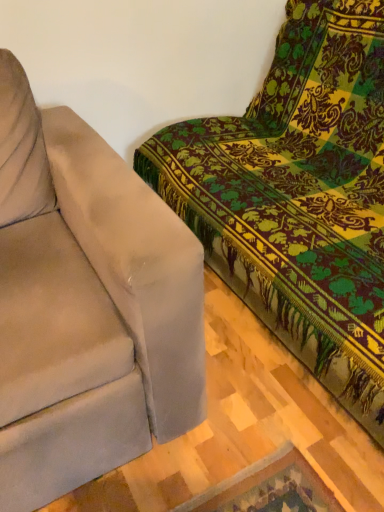
Question: From a real-world perspective, relative to velvet beige couch at upper right, which is counted as the second studio couch, starting from the left, is suede-like beige couch at left, which is the first studio couch from left to right, vertically above or below?

Choices:
 (A) below
 (B) above

Answer: (A)

Question: From the image's perspective, is suede-like beige couch at left, which is the first studio couch from left to right, positioned above or below velvet beige couch at upper right, which is counted as the second studio couch, starting from the left?

Choices:
 (A) above
 (B) below

Answer: (B)

Question: Is point (119, 463) closer or farther from the camera than point (304, 31)?

Choices:
 (A) farther
 (B) closer

Answer: (B)

Question: Considering the positions of velvet beige couch at upper right, which is counted as the second studio couch, starting from the left, and suede-like beige couch at left, marked as the second studio couch in a right-to-left arrangement, in the image, is velvet beige couch at upper right, which is counted as the second studio couch, starting from the left, wider or thinner than suede-like beige couch at left, marked as the second studio couch in a right-to-left arrangement,?

Choices:
 (A) wide
 (B) thin

Answer: (A)

Question: From the image's perspective, is velvet beige couch at upper right, which is counted as the second studio couch, starting from the left, located above or below suede-like beige couch at left, marked as the second studio couch in a right-to-left arrangement?

Choices:
 (A) below
 (B) above

Answer: (B)

Question: From a real-world perspective, is velvet beige couch at upper right, the first studio couch when ordered from right to left, physically located above or below suede-like beige couch at left, which is the first studio couch from left to right?

Choices:
 (A) above
 (B) below

Answer: (A)

Question: Relative to suede-like beige couch at left, marked as the second studio couch in a right-to-left arrangement, is velvet beige couch at upper right, which is counted as the second studio couch, starting from the left, in front or behind?

Choices:
 (A) front
 (B) behind

Answer: (A)